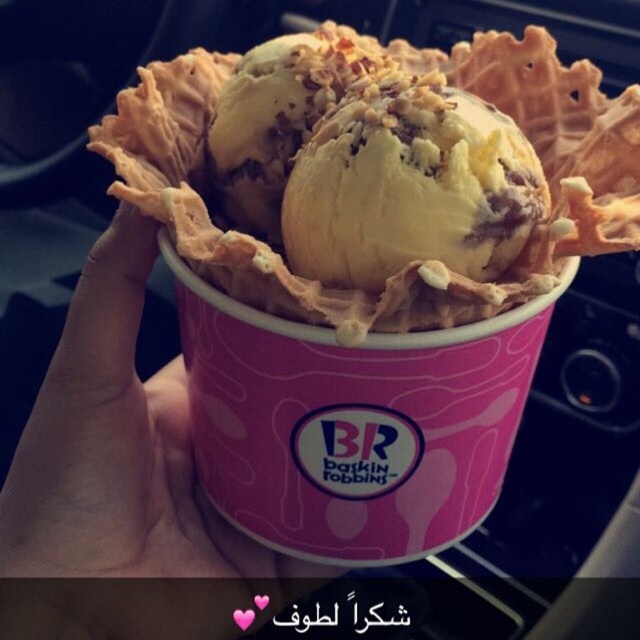
Who is more forward, (188, 164) or (396, 244)?

Point (396, 244) is more forward.

Which of these two, yellow creamy ice cream at center or golden textured ice cream at center, stands shorter?

golden textured ice cream at center is shorter.

Which is behind, point (525, 193) or point (513, 182)?

The point (525, 193) is behind.

At what (x,y) coordinates should I click in order to perform the action: click on yellow creamy ice cream at center. Please return your answer as a coordinate pair (x, y). Image resolution: width=640 pixels, height=640 pixels. Looking at the image, I should click on (378, 173).

Does yellow creamy ice cream at center appear under pink paper cup at center?

No.

Measure the distance from yellow creamy ice cream at center to pink paper cup at center.

They are 11.09 inches apart.

This screenshot has width=640, height=640. Identify the location of yellow creamy ice cream at center. (378, 173).

The width and height of the screenshot is (640, 640). Find the location of `yellow creamy ice cream at center`. yellow creamy ice cream at center is located at coordinates (378, 173).

Does pink paper cup at center have a lesser height compared to golden textured ice cream at center?

Incorrect, pink paper cup at center's height does not fall short of golden textured ice cream at center's.

Is point (164, 449) farther from viewer compared to point (483, 237)?

Yes, point (164, 449) is farther from viewer.

This screenshot has height=640, width=640. What are the coordinates of `pink paper cup at center` in the screenshot? It's located at (116, 449).